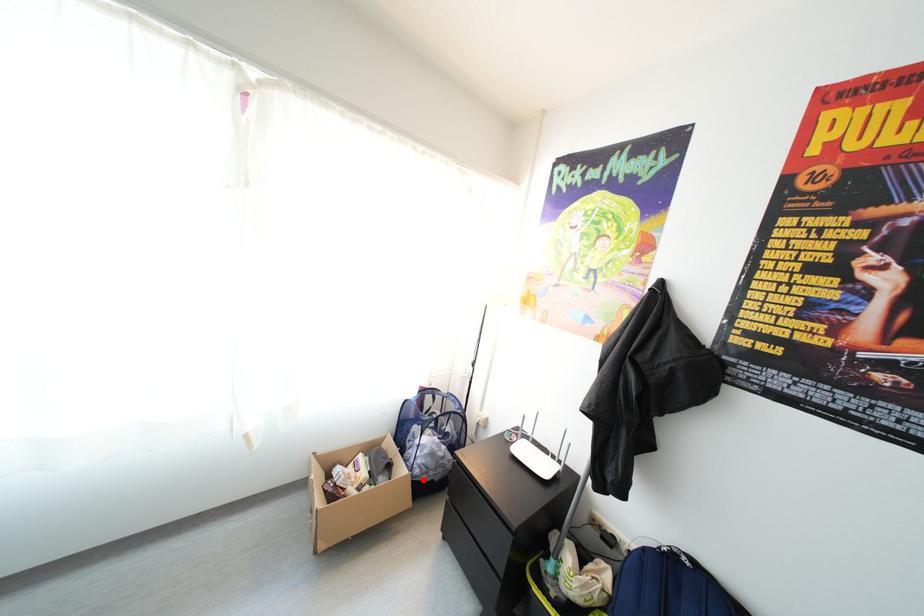
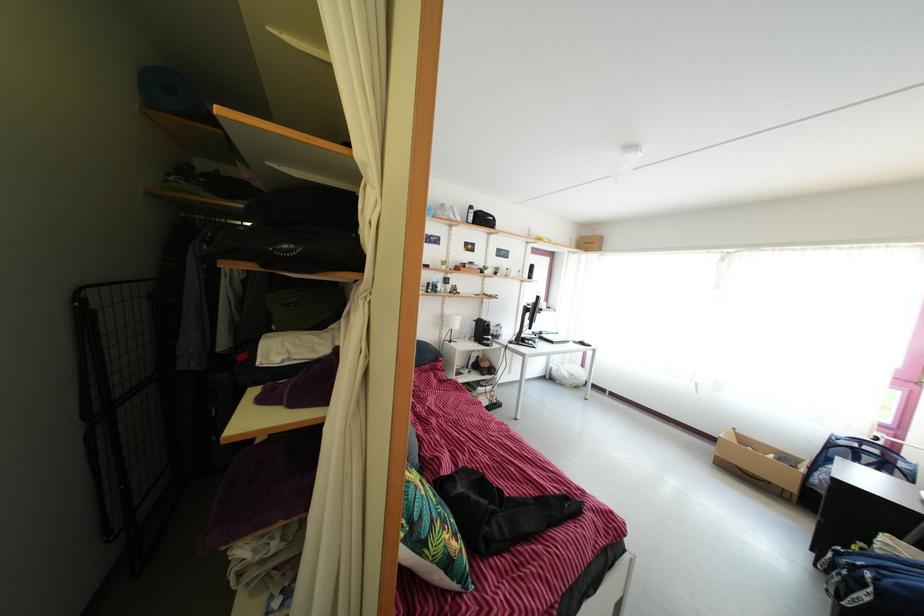
Question: I am providing you with two images of the same scene from different viewpoints. Image1 has a red point marked. In image2, the corresponding 3D location appears at what relative position? Reply with the corresponding letter.

Choices:
 (A) Closer
 (B) Farther

Answer: (B)